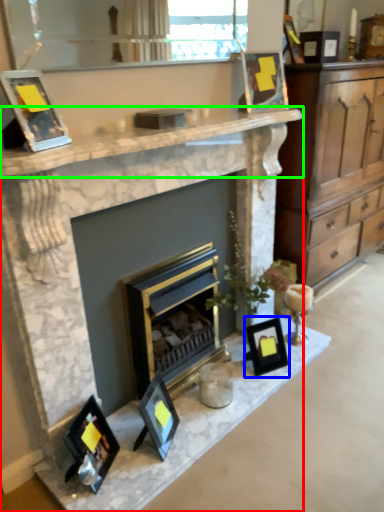
Question: Estimate the real-world distances between objects in this image. Which object is closer to fireplace (highlighted by a red box), picture frame (highlighted by a blue box) or counter top (highlighted by a green box)?

Choices:
 (A) picture frame
 (B) counter top

Answer: (B)